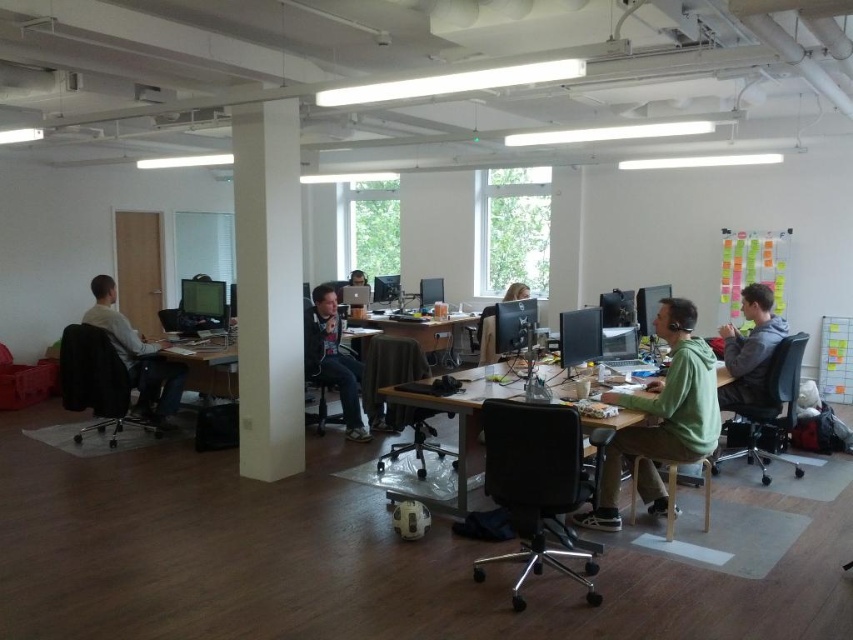
You are an office worker who wants to reach the matte black monitor at center but there is a gray hoodie at right in the way. Can you move around it to access the monitor?

The gray hoodie at right is positioned on the right side of matte black monitor at center, so you can move around to the left side of the matte black monitor at center to access it without obstruction.